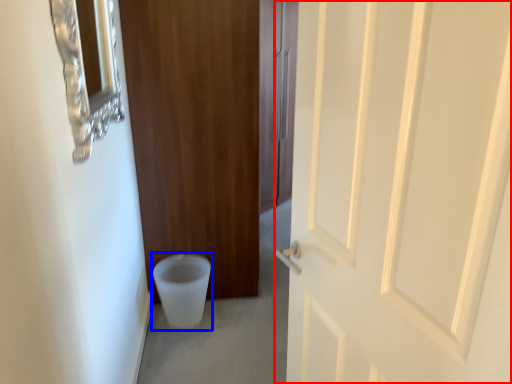
Question: Which object is closer to the camera taking this photo, door (highlighted by a red box) or toilet bowl (highlighted by a blue box)?

Choices:
 (A) door
 (B) toilet bowl

Answer: (A)